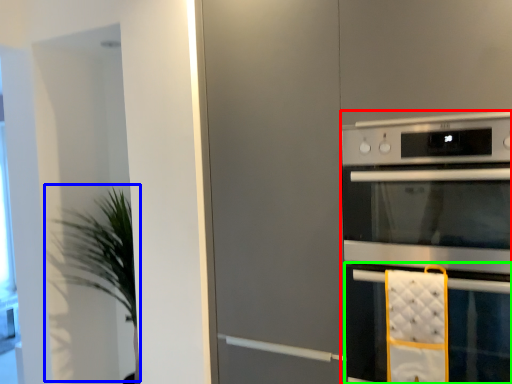
Question: Estimate the real-world distances between objects in this image. Which object is closer to home appliance (highlighted by a red box), plant (highlighted by a blue box) or oven (highlighted by a green box)?

Choices:
 (A) plant
 (B) oven

Answer: (B)